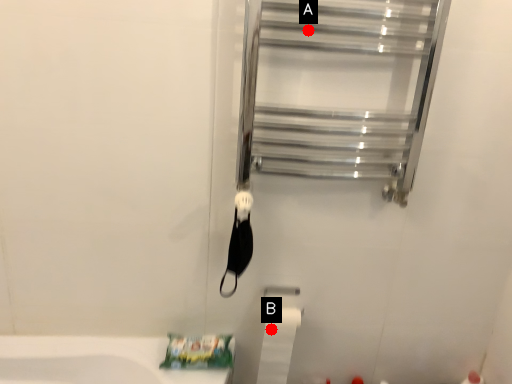
Question: Two points are circled on the image, labeled by A and B beside each circle. Which point appears farthest from the camera in this image?

Choices:
 (A) A is further
 (B) B is further

Answer: (B)